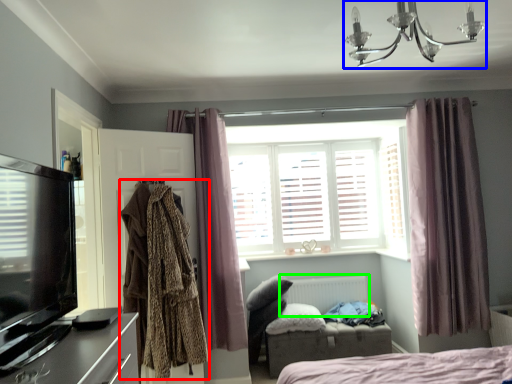
Question: Which object is the closest to the clothing (highlighted by a red box)? Choose among these: light fixture (highlighted by a blue box) or radiator (highlighted by a green box).

Choices:
 (A) light fixture
 (B) radiator

Answer: (B)